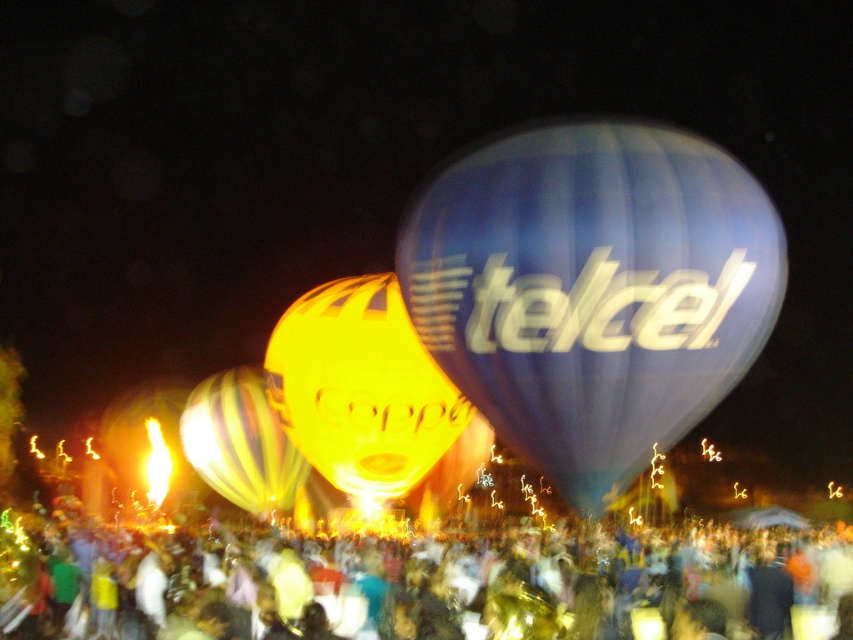
You are a photographer trying to capture a clear shot of the multicolored striped balloon at center. However, the multicolored fabric crowd at lower center is blocking your view. Can you move closer to the balloon to get a better shot?

The multicolored fabric crowd at lower center is in front of the multicolored striped balloon at center, so moving closer might still leave the crowd between you and the balloon unless you find a position where the crowd is not obstructing the view.

You are a photographer trying to capture a clear shot of the shiny yellow balloon at center and the multicolored striped balloon at center. Which balloon should you focus on first if you want to include both in your frame without moving the camera?

The shiny yellow balloon at center is much taller than the multicolored striped balloon at center, so you should focus on the shiny yellow balloon at center first to ensure it fits entirely within the frame.